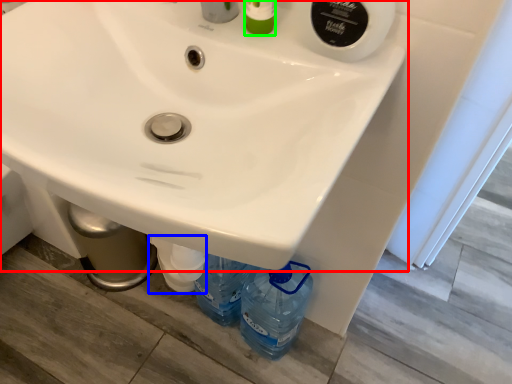
Question: Which is nearer to the sink (highlighted by a red box)? bottle (highlighted by a blue box) or toiletry (highlighted by a green box).

Choices:
 (A) bottle
 (B) toiletry

Answer: (B)